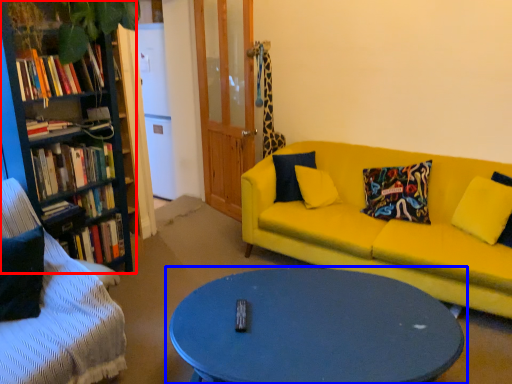
Question: Which point is further to the camera, bookcase (highlighted by a red box) or coffee table (highlighted by a blue box)?

Choices:
 (A) bookcase
 (B) coffee table

Answer: (A)